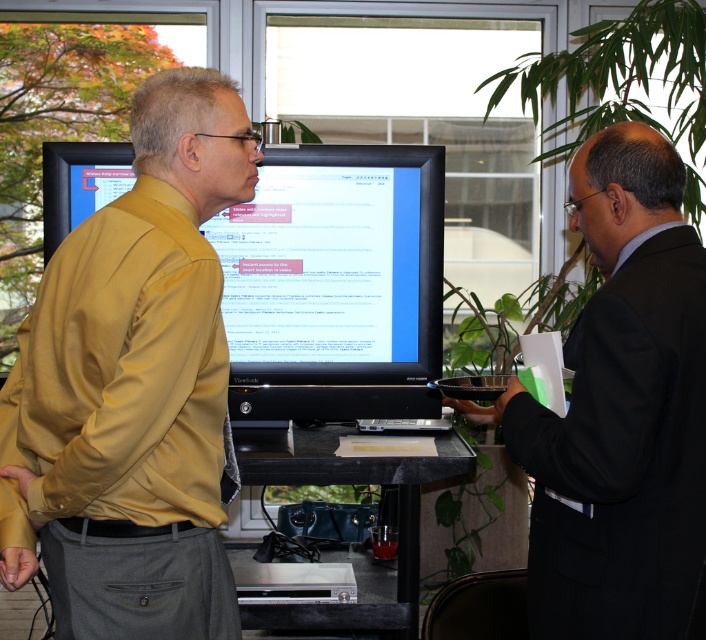
Is matte yellow shirt at center wider than black suit at right?

Correct, the width of matte yellow shirt at center exceeds that of black suit at right.

Consider the image. Measure the distance between point (x=109, y=252) and camera.

Point (x=109, y=252) is 1.56 meters from camera.

You are a GUI agent. You are given a task and a screenshot of the screen. Output one action in this format:
    pyautogui.click(x=<x>, y=<y>)
    Task: Click on the matte yellow shirt at center
    The height and width of the screenshot is (640, 706).
    Given the screenshot: What is the action you would take?
    pyautogui.click(x=137, y=381)

Image resolution: width=706 pixels, height=640 pixels. What do you see at coordinates (137, 381) in the screenshot?
I see `matte yellow shirt at center` at bounding box center [137, 381].

Between matte yellow shirt at center and matte black monitor at center, which one has more height?

Standing taller between the two is matte yellow shirt at center.

Describe the element at coordinates (137, 381) in the screenshot. I see `matte yellow shirt at center` at that location.

Where is `matte yellow shirt at center`? The height and width of the screenshot is (640, 706). matte yellow shirt at center is located at coordinates (137, 381).

Who is more distant from viewer, (570, 564) or (400, 342)?

The point (400, 342) is behind.

Who is lower down, black suit at right or matte black monitor at center?

Positioned lower is black suit at right.

What do you see at coordinates (621, 410) in the screenshot? I see `black suit at right` at bounding box center [621, 410].

The image size is (706, 640). In order to click on black suit at right in this screenshot , I will do `click(621, 410)`.